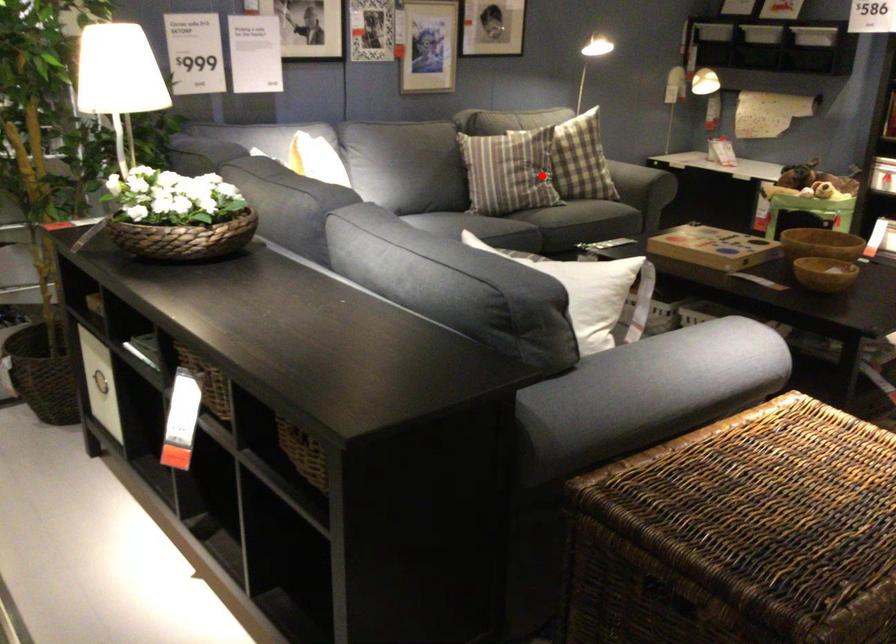
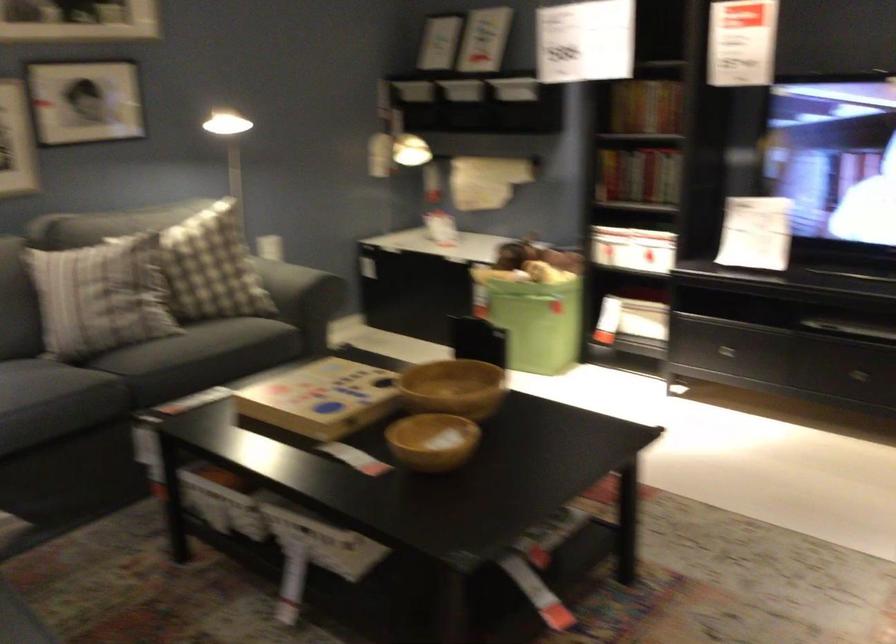
Question: I am providing you with two images of the same scene from different viewpoints. Given a red point in image1, look at the same physical point in image2. Is it:

Choices:
 (A) Closer to the viewpoint
 (B) Farther from the viewpoint

Answer: (A)